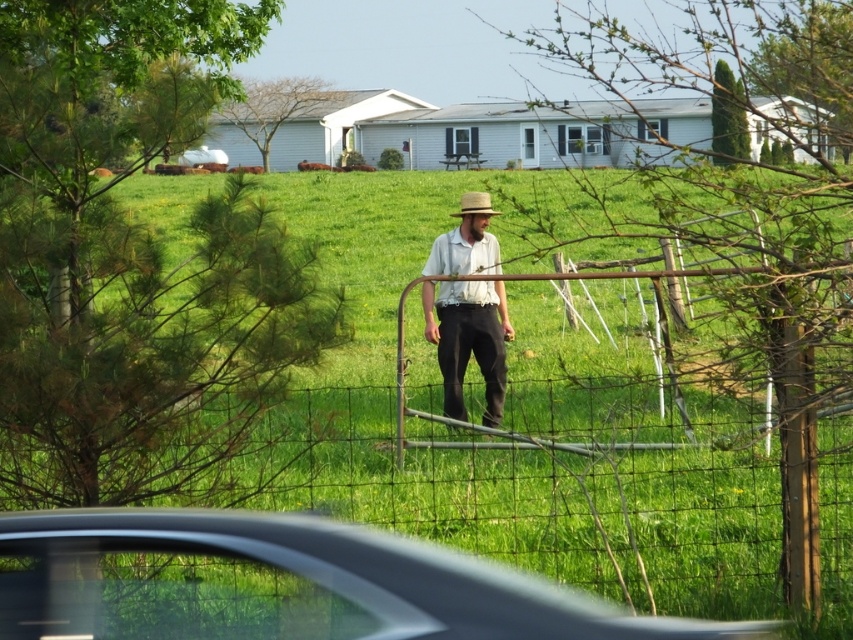
Question: Which object appears farthest from the camera in this image?

Choices:
 (A) light brown straw hat at center
 (B) woven straw hat at center
 (C) green grass at center
 (D) metallic gray car at lower center

Answer: (B)

Question: Considering the real-world distances, which object is closest to the light brown straw hat at center?

Choices:
 (A) metallic gray car at lower center
 (B) green grass at center

Answer: (B)

Question: Which of the following is the closest to the observer?

Choices:
 (A) green grass at center
 (B) woven straw hat at center
 (C) light brown straw hat at center

Answer: (A)

Question: Is green grass at center positioned behind metallic gray car at lower center?

Choices:
 (A) no
 (B) yes

Answer: (B)

Question: Observing the image, what is the correct spatial positioning of light brown straw hat at center in reference to woven straw hat at center?

Choices:
 (A) below
 (B) above

Answer: (A)

Question: Does metallic gray car at lower center have a greater width compared to light brown straw hat at center?

Choices:
 (A) no
 (B) yes

Answer: (B)